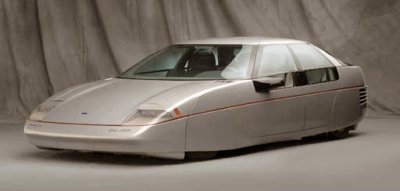
Locate an element on the screen. The width and height of the screenshot is (400, 191). left side window is located at coordinates (276, 62), (305, 57).